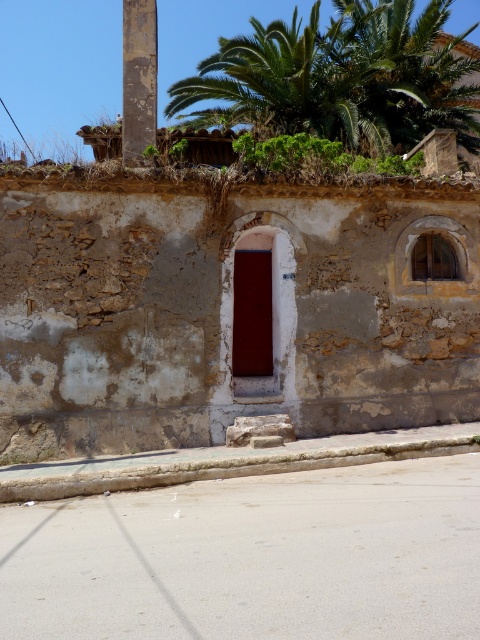
Question: Can you confirm if rusty metal pole at upper left is smaller than green leafy plant at upper center?

Choices:
 (A) yes
 (B) no

Answer: (A)

Question: Is green leafy palm tree at upper center smaller than green leafy plant at upper center?

Choices:
 (A) yes
 (B) no

Answer: (B)

Question: Considering the relative positions of green leafy palm tree at upper center and rusty metal pole at upper left in the image provided, where is green leafy palm tree at upper center located with respect to rusty metal pole at upper left?

Choices:
 (A) right
 (B) left

Answer: (A)

Question: Estimate the real-world distances between objects in this image. Which object is farther from the green leafy plant at upper center?

Choices:
 (A) rusty metal pole at upper left
 (B) green leafy palm tree at upper center

Answer: (B)

Question: Which of these objects is positioned closest to the green leafy palm tree at upper center?

Choices:
 (A) rusty metal pole at upper left
 (B) green leafy plant at upper center

Answer: (B)

Question: Based on their relative distances, which object is nearer to the green leafy plant at upper center?

Choices:
 (A) green leafy palm tree at upper center
 (B) rusty metal pole at upper left

Answer: (B)